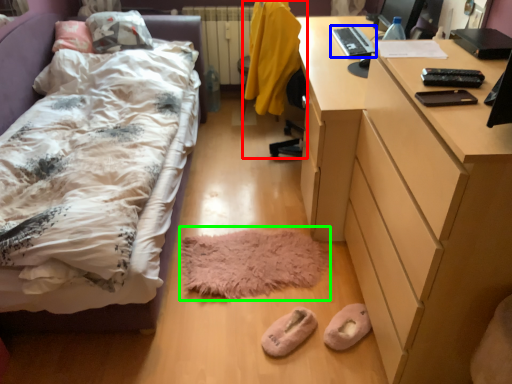
Question: Which is nearer to the swivel chair (highlighted by a red box)? laptop (highlighted by a blue box) or mat (highlighted by a green box).

Choices:
 (A) laptop
 (B) mat

Answer: (A)